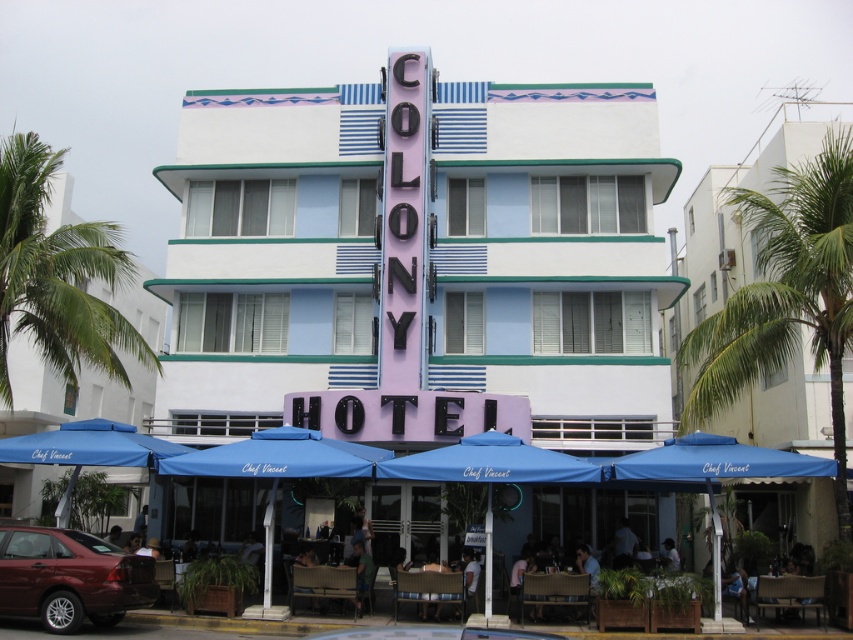
You are a guest at the COLONY HOTEL and want to choose between two blue fabric umbrellas for shade. The blue fabric umbrella at lower center and the blue fabric umbrella at center. Which one offers more shade area?

The blue fabric umbrella at lower center is larger in size than the blue fabric umbrella at center, so it offers a bigger shade area.

You are sitting at a table in the outdoor seating area of the COLONY HOTEL and want to move to the blue fabric umbrella at center. Which direction should you walk relative to the blue fabric umbrella at lower center?

To reach the blue fabric umbrella at center, you should walk behind the blue fabric umbrella at lower center since the blue fabric umbrella at center is positioned behind the blue fabric umbrella at lower center.